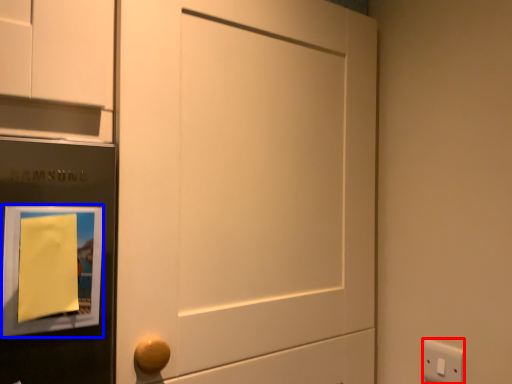
Question: Which point is closer to the camera, light switch (highlighted by a red box) or picture frame (highlighted by a blue box)?

Choices:
 (A) light switch
 (B) picture frame

Answer: (B)